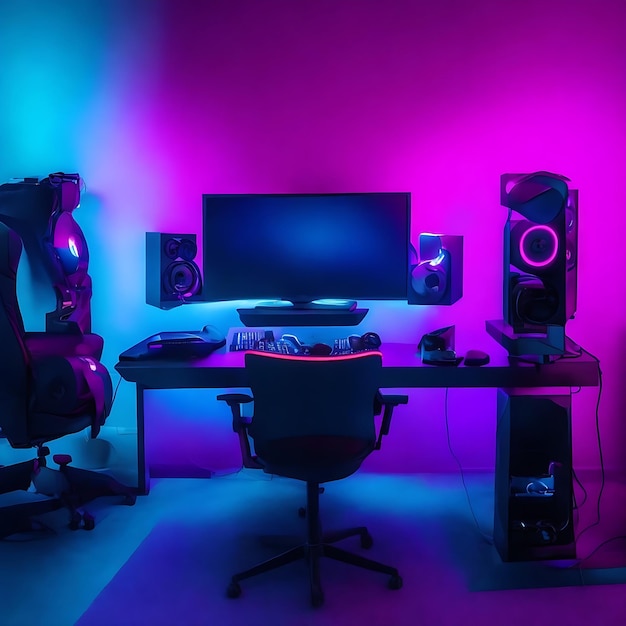
Find the location of a particular element. The image size is (626, 626). computer monitor stands is located at coordinates (304, 320), (327, 305).